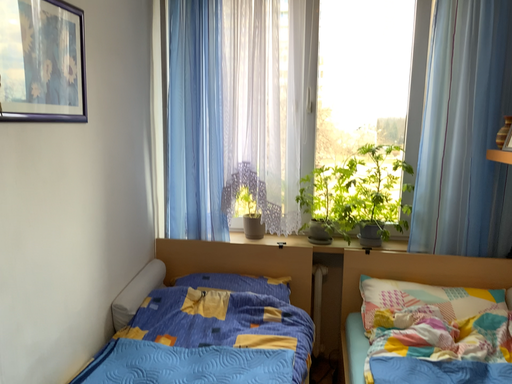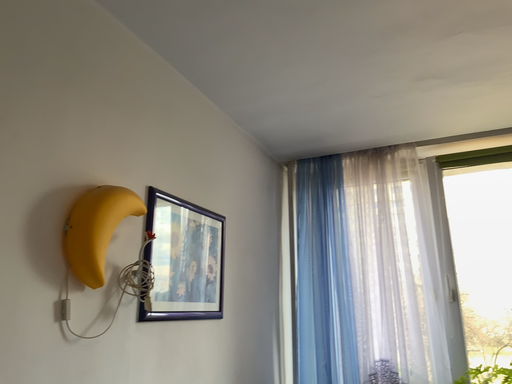
Question: How did the camera likely rotate when shooting the video?

Choices:
 (A) rotated left
 (B) rotated right

Answer: (A)